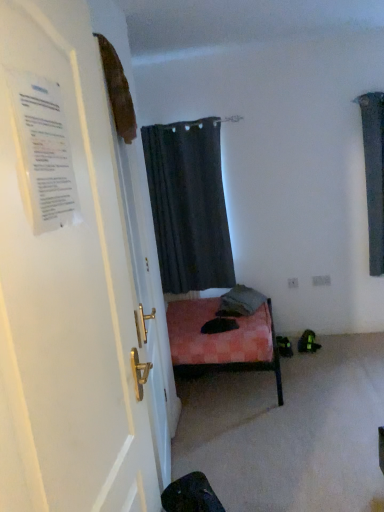
Question: Is dark gray fabric curtain at upper center to the left or to the right of white paper at left in the image?

Choices:
 (A) right
 (B) left

Answer: (A)

Question: From the image's perspective, relative to white paper at left, is dark gray fabric curtain at upper center above or below?

Choices:
 (A) below
 (B) above

Answer: (B)

Question: Which of these objects is positioned closest to the white paper at left?

Choices:
 (A) white glossy door at left
 (B) dark gray fabric curtain at upper center

Answer: (A)

Question: Which object is positioned closest to the white glossy door at left?

Choices:
 (A) white paper at left
 (B) dark gray fabric curtain at upper center

Answer: (A)